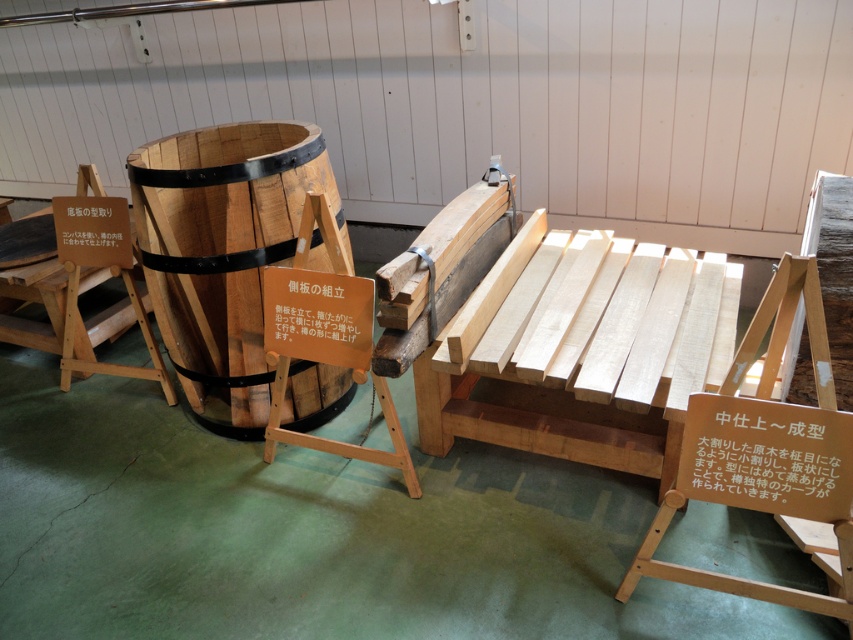
Who is taller, light brown wood chair at center or natural wood chair at center?

With more height is light brown wood chair at center.

Where is `light brown wood chair at center`? The height and width of the screenshot is (640, 853). light brown wood chair at center is located at coordinates (764, 451).

Is point (187, 262) in front of point (775, 308)?

No, (187, 262) is behind (775, 308).

Identify the location of natural wood barrel at center. This screenshot has height=640, width=853. (222, 250).

Can you confirm if natural wood barrel at center is thinner than natural wood chair at center?

Yes.

Is natural wood barrel at center below natural wood chair at center?

Actually, natural wood barrel at center is above natural wood chair at center.

The width and height of the screenshot is (853, 640). What are the coordinates of `natural wood barrel at center` in the screenshot? It's located at (222, 250).